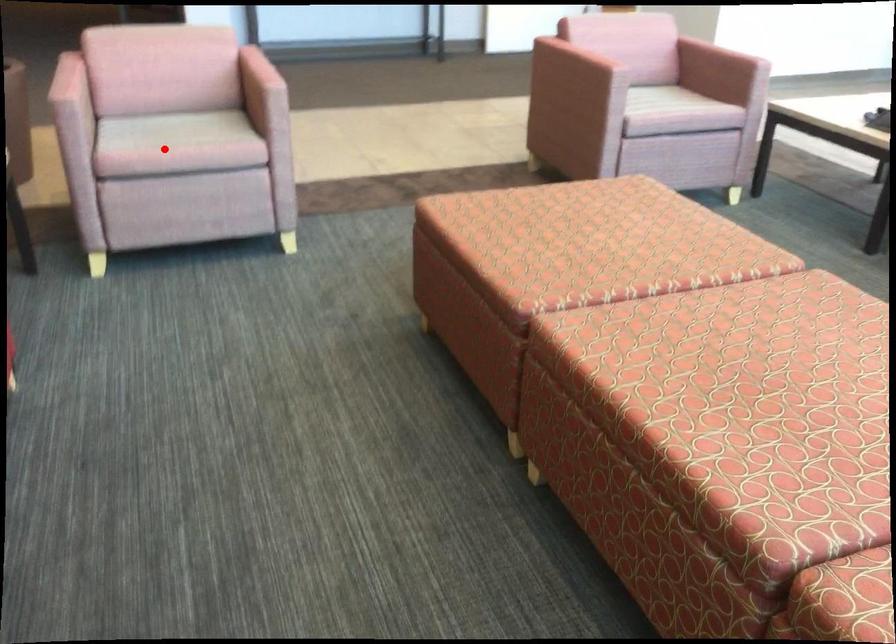
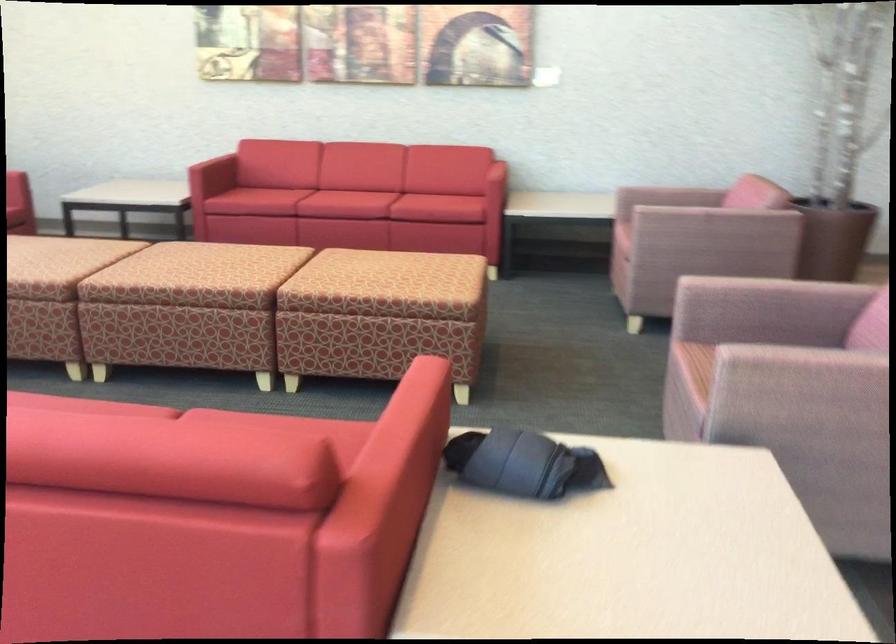
Question: I am providing you with two images of the same scene from different viewpoints. Given a red point in image1, look at the same physical point in image2. Is it:

Choices:
 (A) Closer to the viewpoint
 (B) Farther from the viewpoint

Answer: (B)